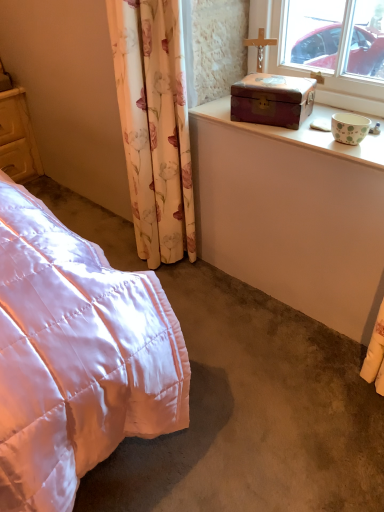
I want to click on unoccupied region to the right of wooden box at upper right, so click(326, 114).